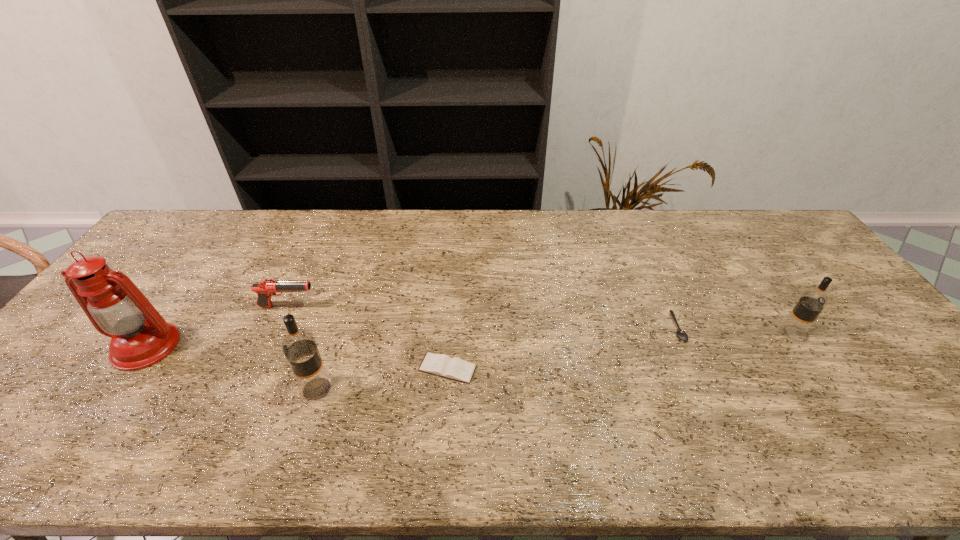
If we want them evenly spaced by inserting an extra vodka among them, please locate a free spot for this new vodka. Please provide its 2D coordinates. Your answer should be formatted as a tuple, i.e. [(x, y)], where the tuple contains the x and y coordinates of a point satisfying the conditions above.

[(567, 360)]